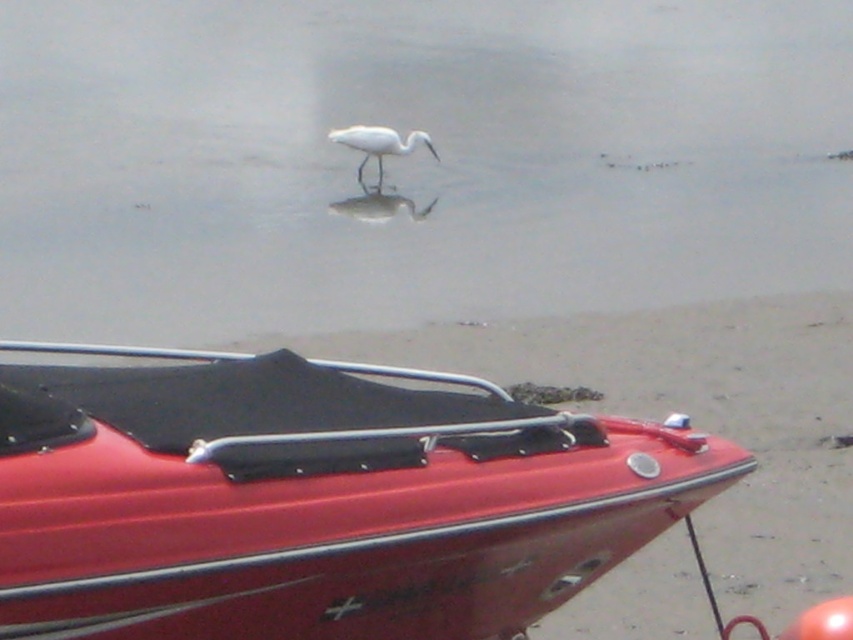
You are a photographer aiming to capture the white matte water at center and the shiny red boat at lower center in a single frame. Based on their positions, which object will appear larger in the photo?

The white matte water at center appears larger in the photo because it has a greater height compared to the shiny red boat at lower center.

You are a photographer trying to capture the white matte bird at center and the white matte water at center in a single shot. Which object should you focus on first if you want to ensure both are in sharp focus?

The white matte bird at center should be focused on first because it is closer to the camera than the white matte water at center, which is farther away.